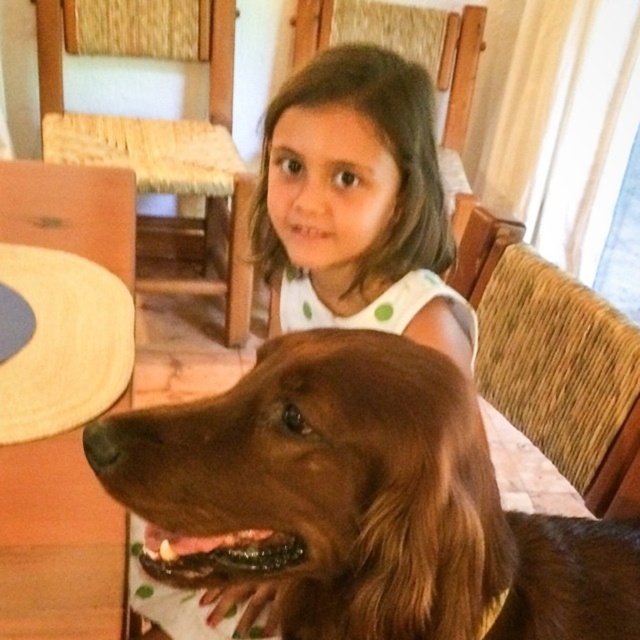
Consider the image. Can you confirm if woven wood chair at upper left is thinner than woven wood chair at right?

In fact, woven wood chair at upper left might be wider than woven wood chair at right.

Who is higher up, woven wood chair at upper left or woven wood chair at right?

woven wood chair at upper left

Identify the location of woven wood chair at upper left. (160, 138).

Can you confirm if brown furry dog at center is positioned to the left of woven wood chair at upper left?

Incorrect, brown furry dog at center is not on the left side of woven wood chair at upper left.

Based on the photo, is brown furry dog at center closer to camera compared to woven wood chair at upper left?

Yes.

Where is `brown furry dog at center`? brown furry dog at center is located at coordinates (364, 500).

Find the location of a particular element. brown furry dog at center is located at coordinates (364, 500).

Is smooth brown hair at center shorter than woven wood chair at upper left?

Indeed, smooth brown hair at center has a lesser height compared to woven wood chair at upper left.

Which is above, smooth brown hair at center or woven wood chair at upper left?

woven wood chair at upper left is above.

This screenshot has height=640, width=640. Find the location of `smooth brown hair at center`. smooth brown hair at center is located at coordinates (358, 202).

This screenshot has width=640, height=640. I want to click on smooth brown hair at center, so [358, 202].